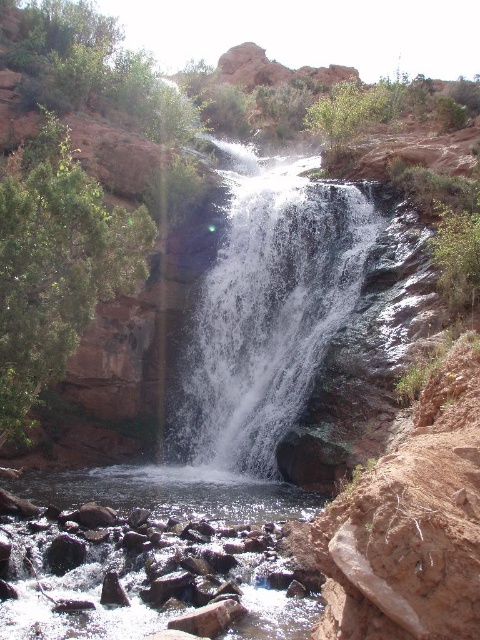
Which is in front, point (226, 403) or point (12, 490)?

Positioned in front is point (12, 490).

Does point (266, 184) come in front of point (192, 499)?

No, it is not.

Where is `white frothy water at center`? white frothy water at center is located at coordinates (267, 308).